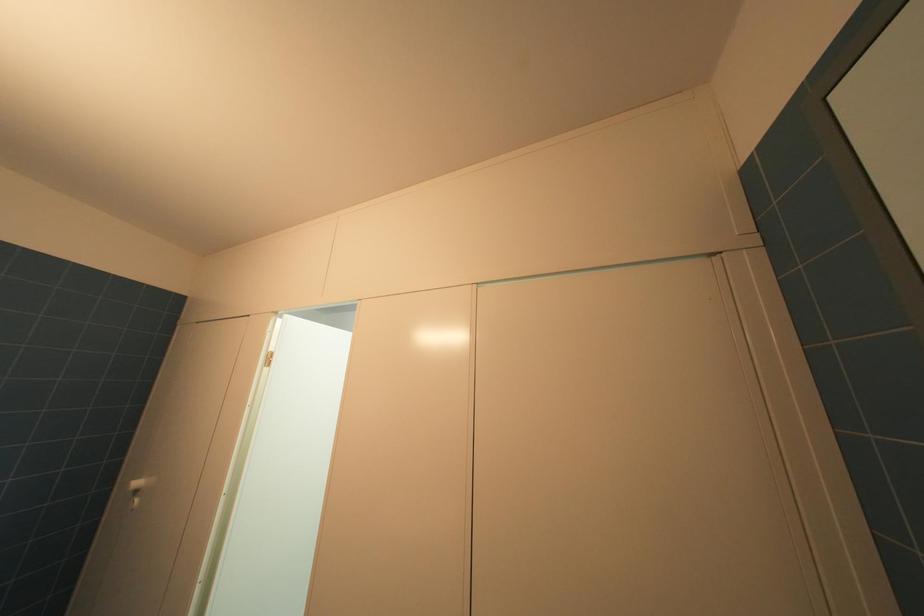
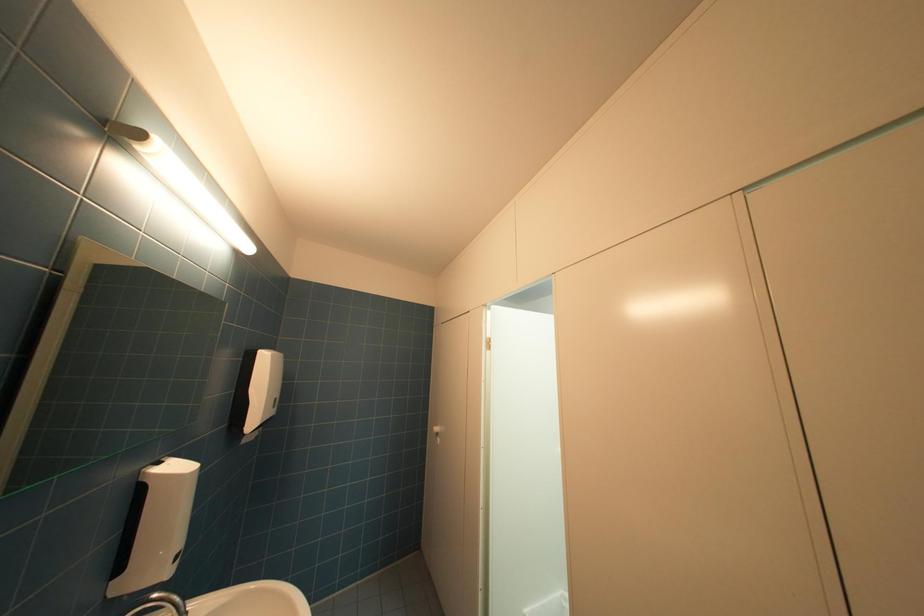
Question: The camera is either moving clockwise (left) or counter-clockwise (right) around the object. The first image is from the beginning of the video and the second image is from the end. Is the camera moving left or right when shooting the video?

Choices:
 (A) Left
 (B) Right

Answer: (B)